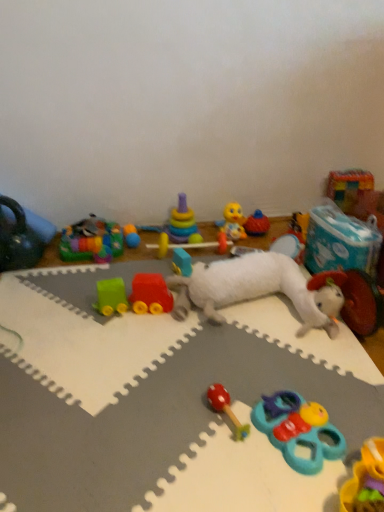
Identify the location of free point above multicolored plastic rainbow at upper left, the 2th toy when ordered from left to right (from a real-world perspective). (94, 233).